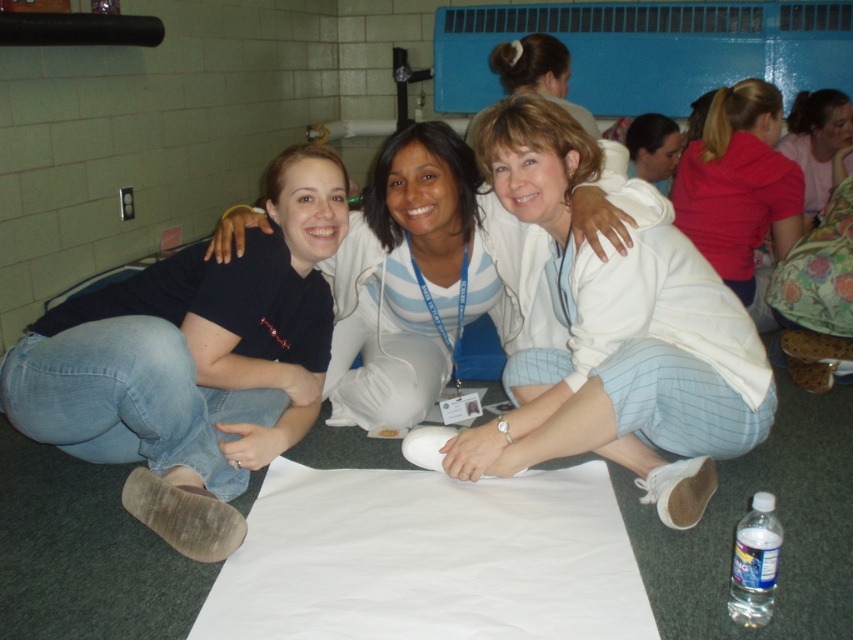
You are organizing a photoshoot and need to ensure that the white soft sweater at center and the pink fabric at upper right are visible in the frame. Based on their positions and sizes, which object should you focus on first to make sure both are in the shot?

The white soft sweater at center should be focused on first because it is taller than the pink fabric at upper right, ensuring its visibility would help frame both objects properly.

You are a photographer setting up a shot of the three women sitting on the floor. You need to ensure that the denim jeans at left and the matte pink shirt at upper right are both visible in the frame. Which object should you focus on first to make sure both are in the frame?

The denim jeans at left is taller than the matte pink shirt at upper right, so you should focus on the denim jeans at left first to ensure both are in the frame.

You are standing at the position of the camera and want to reach the point closer to you between the two points, point (x=62, y=406) and point (x=374, y=353). Which point should you head towards?

Point (x=62, y=406) is in front of point (x=374, y=353), so you should head towards point (x=62, y=406) as it is closer to you.